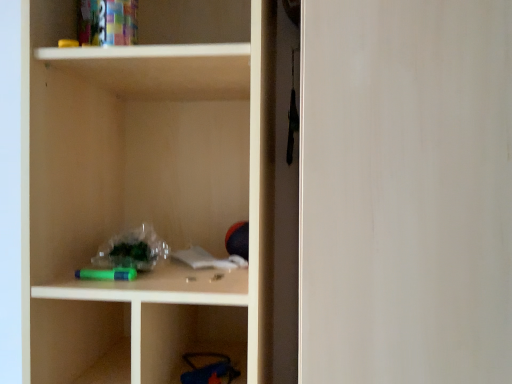
This screenshot has width=512, height=384. Describe the element at coordinates (405, 191) in the screenshot. I see `transparent glass door at right` at that location.

At what (x,y) coordinates should I click in order to perform the action: click on transparent glass door at right. Please return your answer as a coordinate pair (x, y). The height and width of the screenshot is (384, 512). Looking at the image, I should click on (405, 191).

Image resolution: width=512 pixels, height=384 pixels. What do you see at coordinates (150, 189) in the screenshot? I see `matte wood cabinet at center` at bounding box center [150, 189].

Identify the location of matte wood cabinet at center. The width and height of the screenshot is (512, 384). (150, 189).

In order to face matte wood cabinet at center, should I rotate leftwards or rightwards?

It's best to rotate left around 11.411 degrees.

The width and height of the screenshot is (512, 384). In order to click on transparent glass door at right in this screenshot , I will do `click(405, 191)`.

In the image, is matte wood cabinet at center on the left side or the right side of transparent glass door at right?

From the image, it's evident that matte wood cabinet at center is to the left of transparent glass door at right.

Which is in front, matte wood cabinet at center or transparent glass door at right?

transparent glass door at right is more forward.

Is point (106, 376) farther from camera compared to point (435, 313)?

Yes.

From the image's perspective, would you say matte wood cabinet at center is positioned over transparent glass door at right?

Yes, from the image's perspective, matte wood cabinet at center is on top of transparent glass door at right.

From a real-world perspective, which is physically below, matte wood cabinet at center or transparent glass door at right?

transparent glass door at right is physically lower.

Considering the relative sizes of matte wood cabinet at center and transparent glass door at right in the image provided, is matte wood cabinet at center wider than transparent glass door at right?

No.

Considering the relative sizes of matte wood cabinet at center and transparent glass door at right in the image provided, is matte wood cabinet at center shorter than transparent glass door at right?

In fact, matte wood cabinet at center may be taller than transparent glass door at right.

Is matte wood cabinet at center bigger or smaller than transparent glass door at right?

In the image, matte wood cabinet at center appears to be smaller than transparent glass door at right.

Does matte wood cabinet at center contain transparent glass door at right?

No, transparent glass door at right is not inside matte wood cabinet at center.

Is matte wood cabinet at center not close to transparent glass door at right?

No, matte wood cabinet at center is not far from transparent glass door at right.

Is matte wood cabinet at center facing away from transparent glass door at right?

No, matte wood cabinet at center's orientation is not away from transparent glass door at right.

The height and width of the screenshot is (384, 512). Identify the location of cabinetry that is behind the transparent glass door at right. (150, 189).

Considering the positions of objects transparent glass door at right and matte wood cabinet at center in the image provided, who is more to the right, transparent glass door at right or matte wood cabinet at center?

Positioned to the right is transparent glass door at right.

Is transparent glass door at right positioned behind matte wood cabinet at center?

That is False.

Is point (379, 301) closer or farther from the camera than point (183, 195)?

Clearly, point (379, 301) is closer to the camera than point (183, 195).

From the image's perspective, which is above, transparent glass door at right or matte wood cabinet at center?

matte wood cabinet at center.

From a real-world perspective, is transparent glass door at right under matte wood cabinet at center?

Correct, in the physical world, transparent glass door at right is lower than matte wood cabinet at center.

Considering the relative sizes of transparent glass door at right and matte wood cabinet at center in the image provided, is transparent glass door at right wider than matte wood cabinet at center?

Yes.

Which of these two, transparent glass door at right or matte wood cabinet at center, stands taller?

With more height is matte wood cabinet at center.

Based on the photo, in terms of size, does transparent glass door at right appear bigger or smaller than matte wood cabinet at center?

Clearly, transparent glass door at right is larger in size than matte wood cabinet at center.

Is matte wood cabinet at center inside transparent glass door at right?

No, matte wood cabinet at center is not inside transparent glass door at right.

Is transparent glass door at right positioned far away from matte wood cabinet at center?

Actually, transparent glass door at right and matte wood cabinet at center are a little close together.

Is transparent glass door at right positioned with its back to matte wood cabinet at center?

transparent glass door at right is not turned away from matte wood cabinet at center.

Can you tell me how much transparent glass door at right and matte wood cabinet at center differ in facing direction?

There is a 0.521-degree angle between the facing directions of transparent glass door at right and matte wood cabinet at center.

How much distance is there between transparent glass door at right and matte wood cabinet at center?

The distance of transparent glass door at right from matte wood cabinet at center is 14.96 inches.

This screenshot has width=512, height=384. In order to click on cabinetry located above the transparent glass door at right (from the image's perspective) in this screenshot , I will do `click(150, 189)`.

You are a GUI agent. You are given a task and a screenshot of the screen. Output one action in this format:
    pyautogui.click(x=<x>, y=<y>)
    Task: Click on the cabinetry that is on the left side of transparent glass door at right
    This screenshot has width=512, height=384.
    Given the screenshot: What is the action you would take?
    pyautogui.click(x=150, y=189)

Where is `glass door below the matte wood cabinet at center (from the image's perspective)`? glass door below the matte wood cabinet at center (from the image's perspective) is located at coordinates (405, 191).